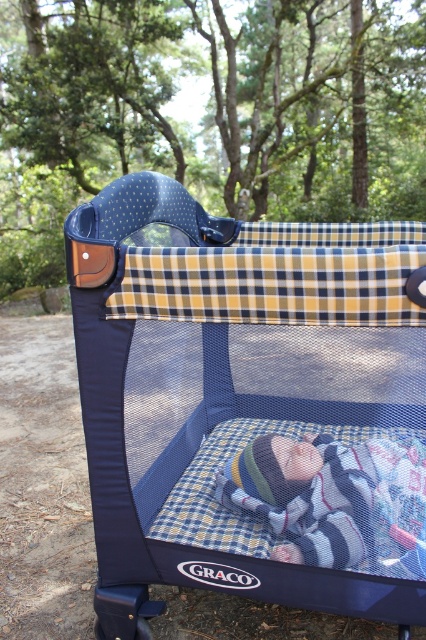
Question: Which point appears closest to the camera in this image?

Choices:
 (A) (409, 566)
 (B) (307, 554)

Answer: (A)

Question: Which point is closer to the camera?

Choices:
 (A) striped knit hat at center
 (B) navy blue mesh playpen at center

Answer: (B)

Question: Among these objects, which one is farthest from the camera?

Choices:
 (A) navy blue mesh playpen at center
 (B) striped knit hat at center

Answer: (B)

Question: Is navy blue mesh playpen at center below striped knit hat at center?

Choices:
 (A) yes
 (B) no

Answer: (B)

Question: Can you confirm if navy blue mesh playpen at center is thinner than striped knit hat at center?

Choices:
 (A) no
 (B) yes

Answer: (A)

Question: Considering the relative positions of navy blue mesh playpen at center and striped knit hat at center in the image provided, where is navy blue mesh playpen at center located with respect to striped knit hat at center?

Choices:
 (A) below
 (B) above

Answer: (B)